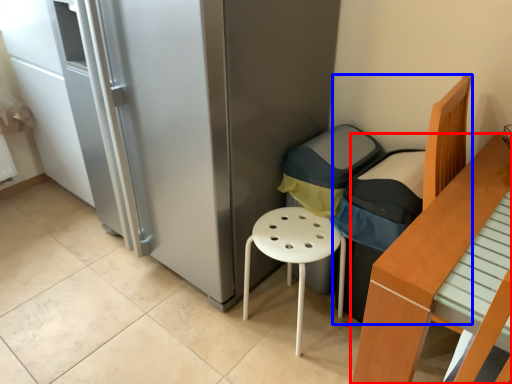
Question: Which object is closer to the camera taking this photo, furniture (highlighted by a red box) or armchair (highlighted by a blue box)?

Choices:
 (A) furniture
 (B) armchair

Answer: (A)